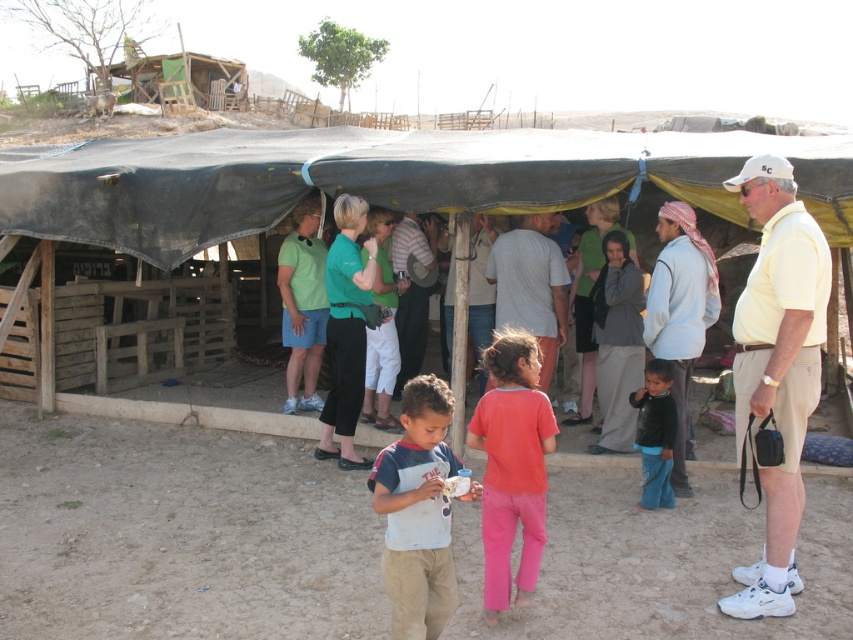
Is black tarpaulin tent at center positioned in front of gray cotton shirt at center?

Yes, it is in front of gray cotton shirt at center.

The image size is (853, 640). What do you see at coordinates (374, 179) in the screenshot?
I see `black tarpaulin tent at center` at bounding box center [374, 179].

Identify the location of black tarpaulin tent at center. (374, 179).

Is point (814, 291) positioned after point (556, 305)?

No, (814, 291) is closer to viewer.

Based on the photo, which is more to the right, yellow cotton shirt at right or gray cotton shirt at center?

yellow cotton shirt at right is more to the right.

Who is more forward, (804, 362) or (521, 275)?

Point (804, 362)

This screenshot has width=853, height=640. What are the coordinates of `yellow cotton shirt at right` in the screenshot? It's located at (776, 365).

Does black tarpaulin tent at center have a larger size compared to matte pink pants at center?

Actually, black tarpaulin tent at center might be smaller than matte pink pants at center.

Between black tarpaulin tent at center and matte pink pants at center, which one appears on the left side from the viewer's perspective?

black tarpaulin tent at center is more to the left.

Which is behind, point (540, 184) or point (537, 435)?

Point (540, 184)

Locate an element on the screen. This screenshot has height=640, width=853. black tarpaulin tent at center is located at coordinates (374, 179).